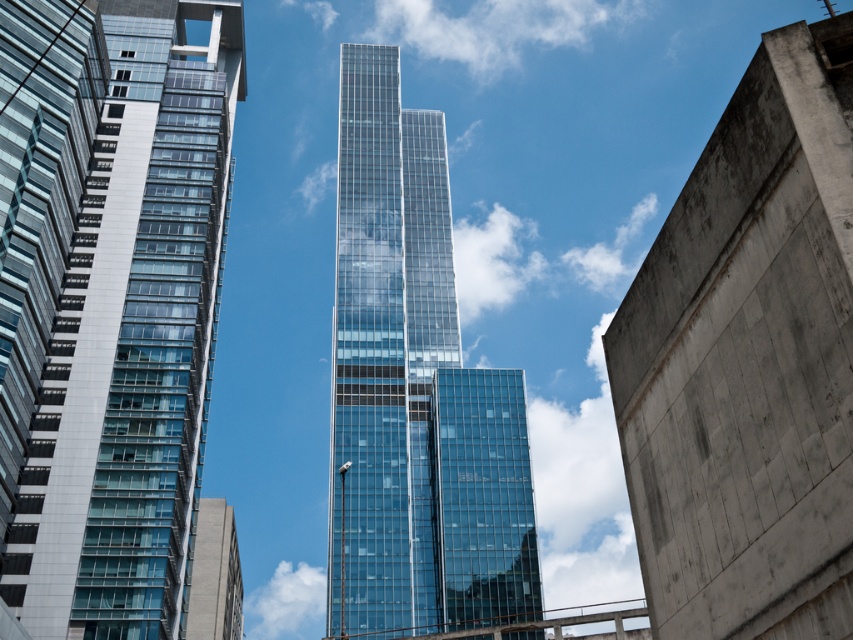
Between glassy blue skyscraper at left and transparent glass building at center, which one is positioned higher?

transparent glass building at center

Between point (47, 417) and point (410, 296), which one is positioned behind?

Point (410, 296)

I want to click on glassy blue skyscraper at left, so click(x=108, y=301).

Does transparent glass building at center have a greater height compared to transparent glass tower at center?

Correct, transparent glass building at center is much taller as transparent glass tower at center.

Is point (436, 465) closer to camera compared to point (339, 513)?

No, (436, 465) is behind (339, 513).

You are a GUI agent. You are given a task and a screenshot of the screen. Output one action in this format:
    pyautogui.click(x=<x>, y=<y>)
    Task: Click on the transparent glass building at center
    The height and width of the screenshot is (640, 853).
    Given the screenshot: What is the action you would take?
    pyautogui.click(x=415, y=394)

Is glassy blue skyscraper at left in front of smooth concrete wall at right?

No, it is not.

Is glassy blue skyscraper at left above smooth concrete wall at right?

Yes, glassy blue skyscraper at left is above smooth concrete wall at right.

Does point (151, 493) come farther from viewer compared to point (844, 365)?

Yes.

Find the location of `glassy blue skyscraper at left`. glassy blue skyscraper at left is located at coordinates (108, 301).